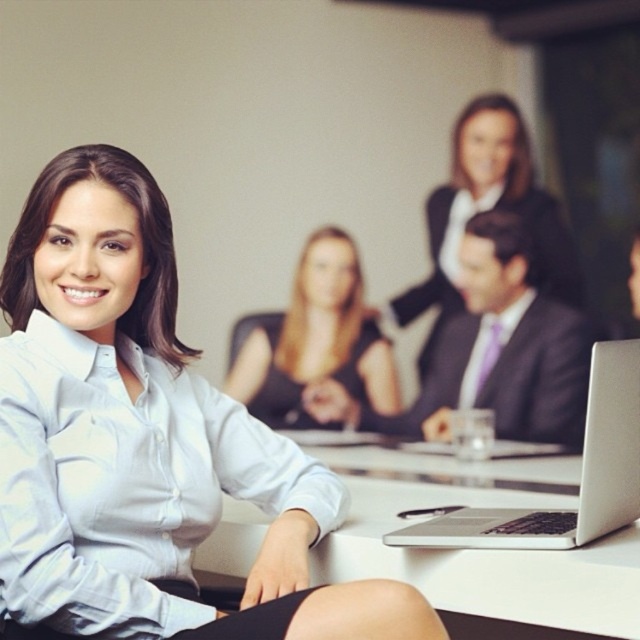
Question: Which object is farther from the camera taking this photo?

Choices:
 (A) purple satin business suit at center
 (B) black glossy dress at center

Answer: (B)

Question: Does black glossy dress at center have a larger size compared to matte black suit at center?

Choices:
 (A) no
 (B) yes

Answer: (B)

Question: Is black glossy dress at center above silver metallic laptop at center?

Choices:
 (A) no
 (B) yes

Answer: (B)

Question: Which object appears farthest from the camera in this image?

Choices:
 (A) black glossy dress at center
 (B) white glossy table at center

Answer: (A)

Question: Is white glossy table at center in front of purple satin business suit at center?

Choices:
 (A) yes
 (B) no

Answer: (A)

Question: Which point is farther to the camera?

Choices:
 (A) purple satin business suit at center
 (B) white glossy table at center
 (C) black glossy dress at center
 (D) matte black suit at center

Answer: (C)